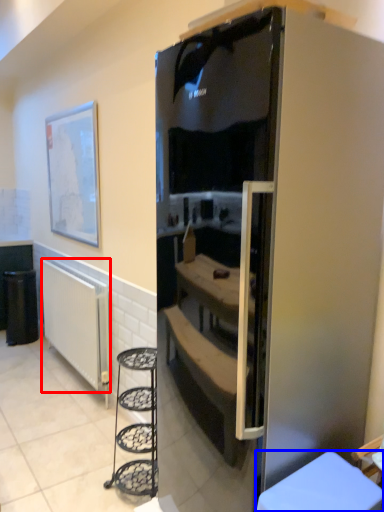
Question: Among these objects, which one is farthest to the camera, radiator (highlighted by a red box) or furniture (highlighted by a blue box)?

Choices:
 (A) radiator
 (B) furniture

Answer: (A)